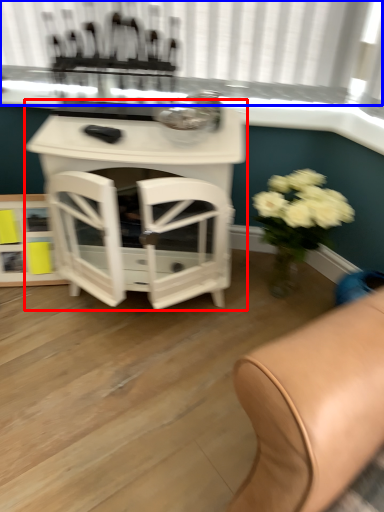
Question: Among these objects, which one is farthest to the camera, table (highlighted by a red box) or bay window (highlighted by a blue box)?

Choices:
 (A) table
 (B) bay window

Answer: (B)